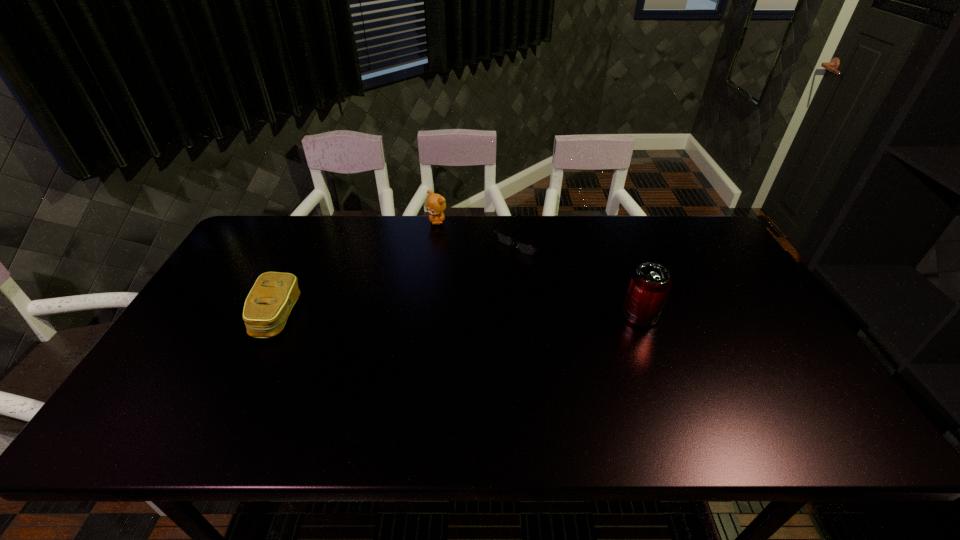
You are a GUI agent. You are given a task and a screenshot of the screen. Output one action in this format:
    pyautogui.click(x=<x>, y=<y>)
    Task: Click on the free space located on the zipper side of the third tallest object
    This screenshot has height=540, width=960.
    Given the screenshot: What is the action you would take?
    pyautogui.click(x=192, y=316)

Find the location of a particular element. vacant space located on the back of the tallest object is located at coordinates (623, 272).

Where is `free spot located on the front-facing side of the shortest object`? The width and height of the screenshot is (960, 540). free spot located on the front-facing side of the shortest object is located at coordinates (463, 293).

Where is `vacant space situated 0.250m on the front-facing side of the shortest object`? The height and width of the screenshot is (540, 960). vacant space situated 0.250m on the front-facing side of the shortest object is located at coordinates (458, 296).

This screenshot has width=960, height=540. Find the location of `vacant space situated 0.150m on the front-facing side of the shortest object`. vacant space situated 0.150m on the front-facing side of the shortest object is located at coordinates (479, 279).

You are a GUI agent. You are given a task and a screenshot of the screen. Output one action in this format:
    pyautogui.click(x=<x>, y=<y>)
    Task: Click on the vacant space positioned on the face of the teddy bear
    The height and width of the screenshot is (540, 960).
    Given the screenshot: What is the action you would take?
    pyautogui.click(x=442, y=275)

This screenshot has width=960, height=540. I want to click on vacant area situated on the face of the teddy bear, so click(442, 273).

In order to click on vacant space located on the face of the teddy bear in this screenshot , I will do `click(439, 241)`.

Identify the location of spectacles at the far edge. This screenshot has height=540, width=960. (525, 248).

This screenshot has height=540, width=960. In order to click on teddy bear located in the far edge section of the desktop in this screenshot , I will do click(435, 205).